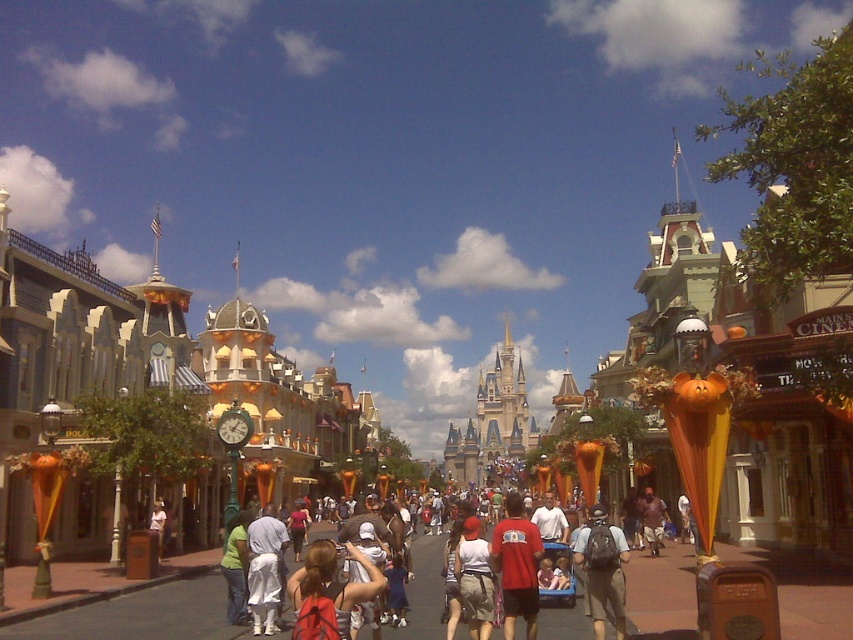
Between point (577, 634) and point (529, 584), which one is positioned behind?

Point (577, 634)

Which of these two, red shirt at center or red t-shirt at center, stands taller?

red t-shirt at center is taller.

Identify the location of red shirt at center. The image size is (853, 640). (662, 595).

The width and height of the screenshot is (853, 640). In order to click on red shirt at center in this screenshot , I will do `click(662, 595)`.

From the picture: Between red shirt at center and gray fabric backpack at center, which one has more height?

red shirt at center

Measure the distance between point [635,579] and camera.

A distance of 212.33 feet exists between point [635,579] and camera.

Identify the location of red shirt at center. (662, 595).

Which is in front, point (503, 525) or point (590, 614)?

Positioned in front is point (590, 614).

Between red t-shirt at center and gray fabric backpack at center, which one has less height?

With less height is gray fabric backpack at center.

The image size is (853, 640). What do you see at coordinates (517, 564) in the screenshot?
I see `red t-shirt at center` at bounding box center [517, 564].

You are a GUI agent. You are given a task and a screenshot of the screen. Output one action in this format:
    pyautogui.click(x=<x>, y=<y>)
    Task: Click on the red t-shirt at center
    The image size is (853, 640).
    Given the screenshot: What is the action you would take?
    pyautogui.click(x=517, y=564)